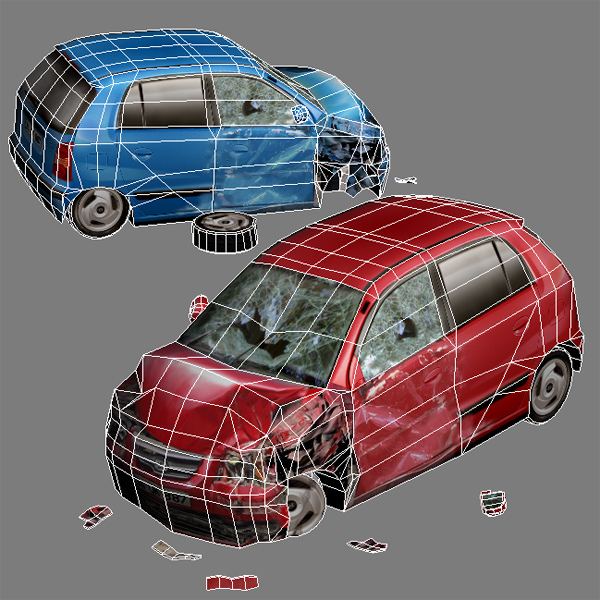
Locate an element on the screen. Image resolution: width=600 pixels, height=600 pixels. window is located at coordinates (223, 91).